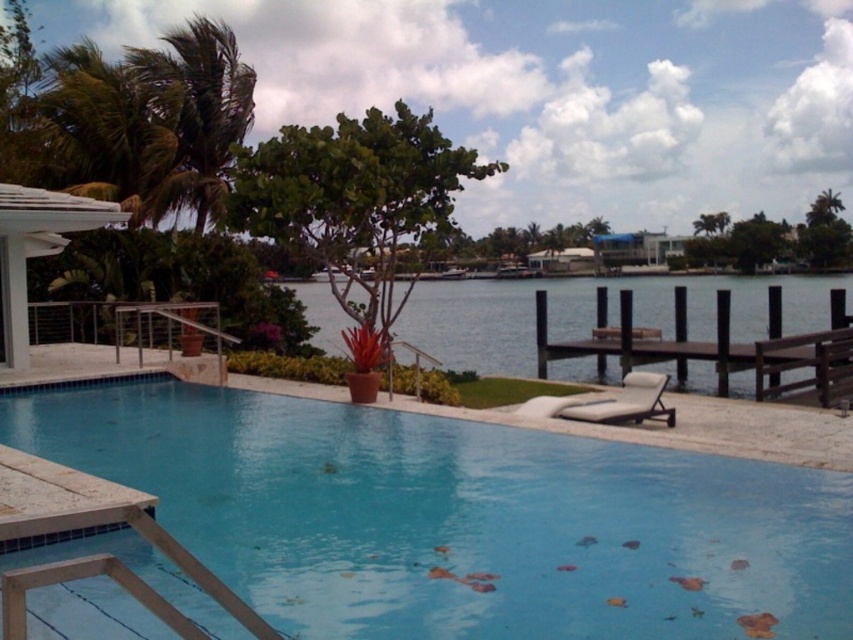
Question: Is blue tile swimming pool at center below white fabric daybed at lower right?

Choices:
 (A) no
 (B) yes

Answer: (B)

Question: Does brown wooden dock at lower right have a smaller size compared to white fabric daybed at lower right?

Choices:
 (A) no
 (B) yes

Answer: (A)

Question: Which point appears closest to the camera in this image?

Choices:
 (A) (642, 321)
 (B) (824, 332)

Answer: (B)

Question: Considering the real-world distances, which object is farthest from the blue wooden dock at center?

Choices:
 (A) green leafy palm tree at upper left
 (B) blue tile swimming pool at center

Answer: (B)

Question: Is brown wooden dock at lower right to the right of white fabric daybed at lower right from the viewer's perspective?

Choices:
 (A) yes
 (B) no

Answer: (A)

Question: Based on their relative distances, which object is nearer to the white fabric daybed at lower right?

Choices:
 (A) brown wooden dock at lower right
 (B) green leafy palm tree at upper left
 (C) blue tile swimming pool at center
 (D) blue wooden dock at center

Answer: (C)